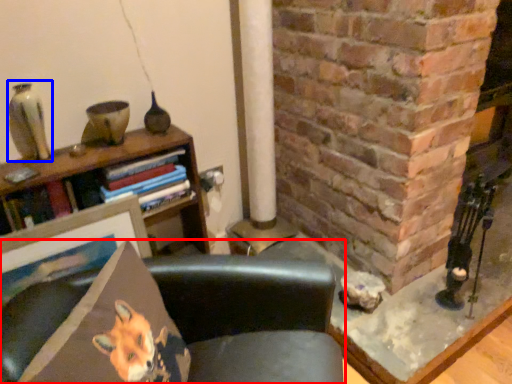
Question: Which point is further to the camera, chair (highlighted by a red box) or gray (highlighted by a blue box)?

Choices:
 (A) chair
 (B) gray

Answer: (B)